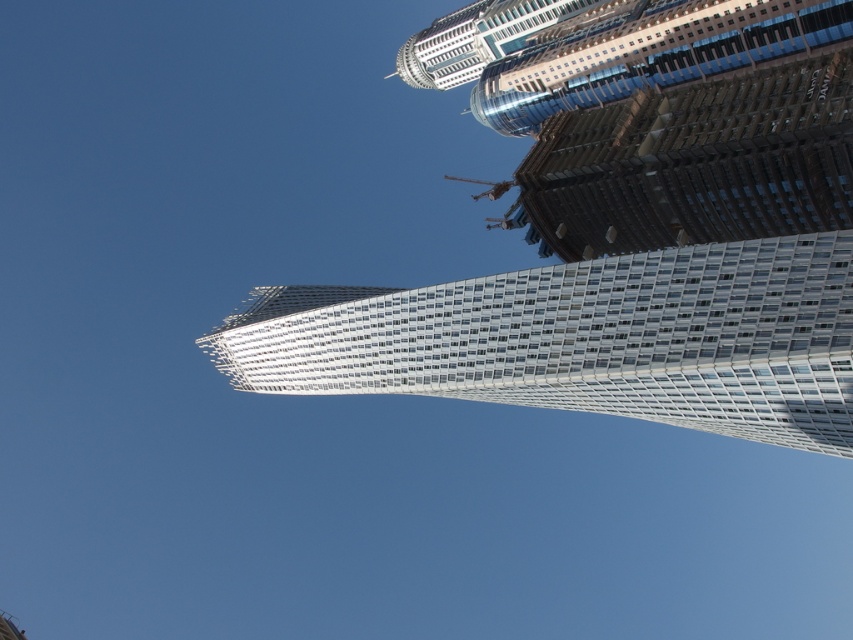
Question: Is white glass building at center to the left of metallic glass skyscraper at upper center from the viewer's perspective?

Choices:
 (A) no
 (B) yes

Answer: (A)

Question: From the image, what is the correct spatial relationship of white glass building at center in relation to metallic glass skyscraper at upper center?

Choices:
 (A) left
 (B) right

Answer: (B)

Question: Which of the following is the closest to the observer?

Choices:
 (A) white glass building at center
 (B) metallic glass skyscraper at upper center

Answer: (A)

Question: Which of the following is the farthest from the observer?

Choices:
 (A) metallic glass skyscraper at upper center
 (B) white glass building at center

Answer: (A)

Question: Which point appears farthest from the camera in this image?

Choices:
 (A) (389, 333)
 (B) (549, 6)

Answer: (B)

Question: Can you confirm if white glass building at center is wider than metallic glass skyscraper at upper center?

Choices:
 (A) yes
 (B) no

Answer: (A)